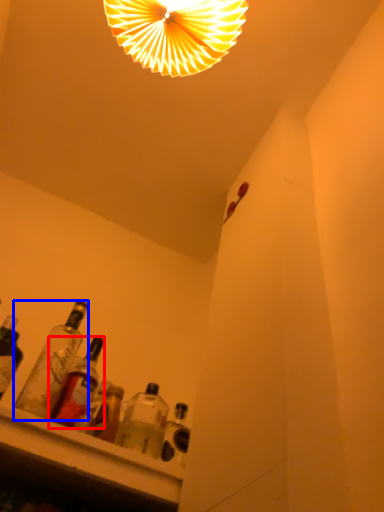
Question: Which of the following is the closest to the observer, bottle (highlighted by a red box) or bottle (highlighted by a blue box)?

Choices:
 (A) bottle
 (B) bottle

Answer: (B)